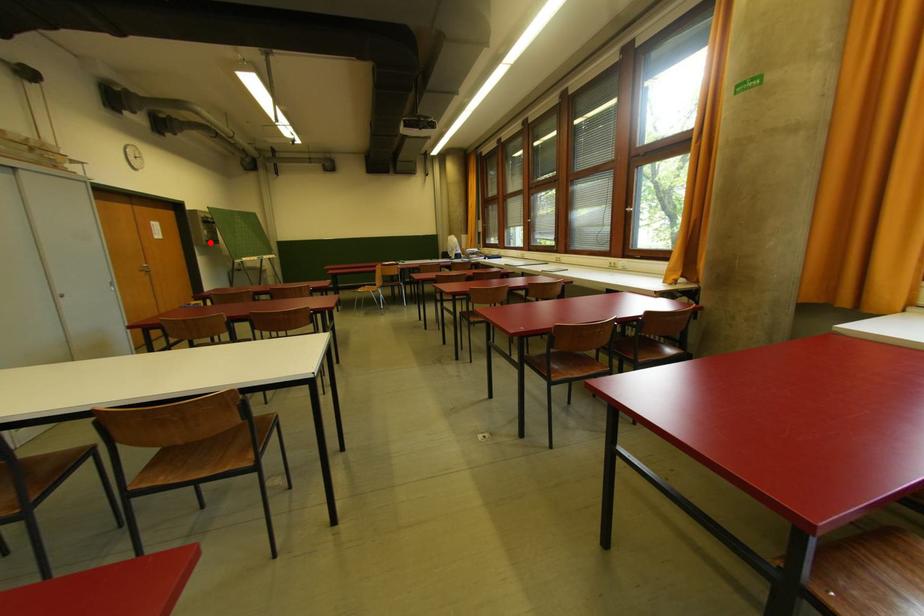
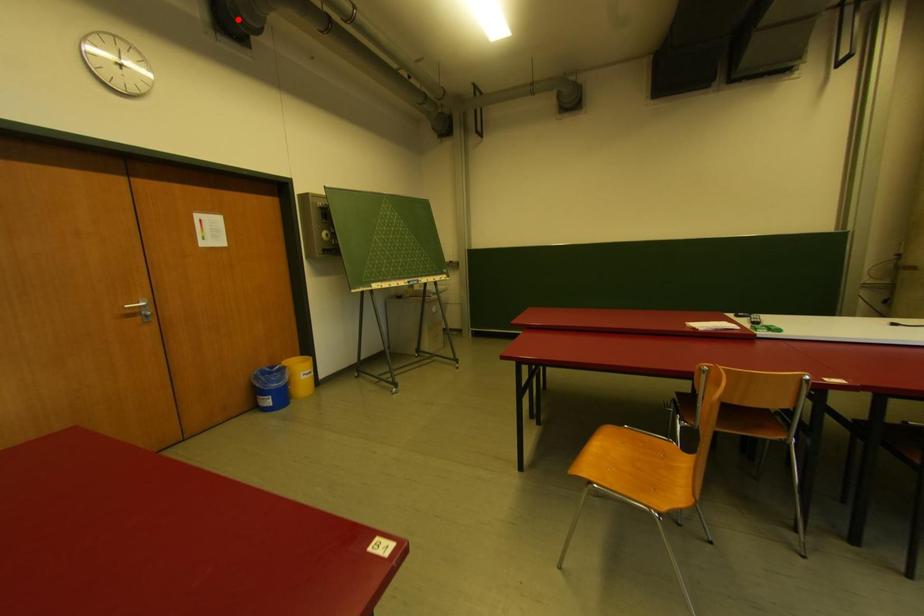
I am providing you with two images of the same scene from different viewpoints. A red point is marked on the first image and another point is marked on the second image. Are the points marked in image1 and image2 representing the same 3D position?

No